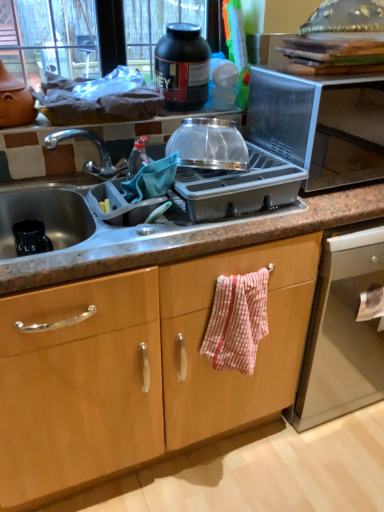
Identify the location of vacant space underneath red and white checkered fabric at center (from a real-world perspective). (228, 468).